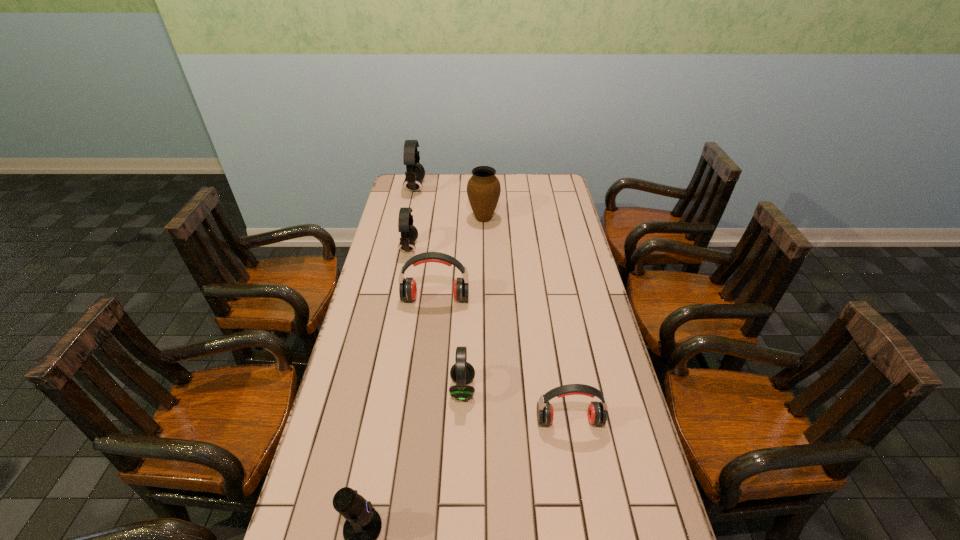
This screenshot has width=960, height=540. In order to click on the nearer red earphone in this screenshot , I will do `click(597, 415)`.

This screenshot has height=540, width=960. Identify the location of the sixth farthest object. (597, 415).

What are the coordinates of `vacant space located on the ear cups of the farthest object` in the screenshot? It's located at (504, 188).

Where is `vacant space located 0.180m on the back of the urn`? vacant space located 0.180m on the back of the urn is located at coordinates (483, 190).

Identify the location of vacant space located 0.180m on the ear cups of the left red earphone. The height and width of the screenshot is (540, 960). (430, 346).

The height and width of the screenshot is (540, 960). What are the coordinates of `vacant space situated on the ear cups of the third farthest object` in the screenshot? It's located at (508, 248).

Find the location of a particular element. The image size is (960, 540). free space located on the ear cups of the fifth farthest object is located at coordinates (502, 389).

Find the location of a particular element. This screenshot has width=960, height=540. blank area located on the ear cups of the nearer red earphone is located at coordinates (577, 466).

Find the location of a particular element. This screenshot has height=540, width=960. object present at the far edge is located at coordinates click(x=415, y=172).

This screenshot has width=960, height=540. What are the coordinates of `object located at the right edge` in the screenshot? It's located at (597, 415).